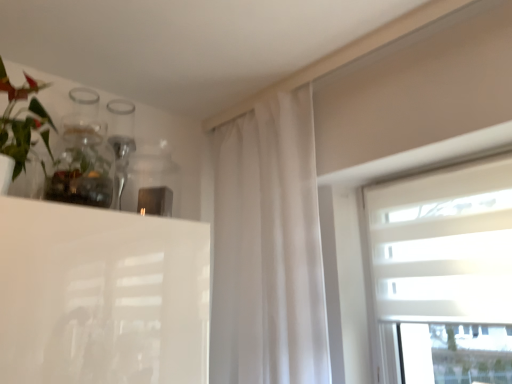
Question: Does clear glass vase at upper left have a greater height compared to white textured blinds at upper right?

Choices:
 (A) no
 (B) yes

Answer: (A)

Question: Can you confirm if clear glass vase at upper left is smaller than white textured blinds at upper right?

Choices:
 (A) no
 (B) yes

Answer: (B)

Question: Is clear glass vase at upper left positioned beyond the bounds of white textured blinds at upper right?

Choices:
 (A) no
 (B) yes

Answer: (B)

Question: Is clear glass vase at upper left at the left side of white textured blinds at upper right?

Choices:
 (A) no
 (B) yes

Answer: (B)

Question: Can you confirm if clear glass vase at upper left is wider than white textured blinds at upper right?

Choices:
 (A) no
 (B) yes

Answer: (B)

Question: Is clear glass vase at upper left to the left or to the right of white textured blinds at upper right in the image?

Choices:
 (A) left
 (B) right

Answer: (A)

Question: From a real-world perspective, is clear glass vase at upper left above or below white textured blinds at upper right?

Choices:
 (A) above
 (B) below

Answer: (A)

Question: Considering the positions of clear glass vase at upper left and white textured blinds at upper right in the image, is clear glass vase at upper left bigger or smaller than white textured blinds at upper right?

Choices:
 (A) big
 (B) small

Answer: (B)

Question: From the image's perspective, is clear glass vase at upper left located above or below white textured blinds at upper right?

Choices:
 (A) above
 (B) below

Answer: (A)

Question: Does point (472, 241) appear closer or farther from the camera than point (79, 187)?

Choices:
 (A) closer
 (B) farther

Answer: (B)

Question: Based on their positions, is white textured blinds at upper right located to the left or right of green matte plant at upper left?

Choices:
 (A) right
 (B) left

Answer: (A)

Question: From a real-world perspective, relative to green matte plant at upper left, is white textured blinds at upper right vertically above or below?

Choices:
 (A) above
 (B) below

Answer: (B)

Question: Which is correct: white textured blinds at upper right is inside green matte plant at upper left, or outside of it?

Choices:
 (A) outside
 (B) inside

Answer: (A)

Question: Considering the positions of point (26, 153) and point (58, 147), is point (26, 153) closer or farther from the camera than point (58, 147)?

Choices:
 (A) farther
 (B) closer

Answer: (B)

Question: Is green matte plant at upper left situated inside clear glass vase at upper left or outside?

Choices:
 (A) inside
 (B) outside

Answer: (B)